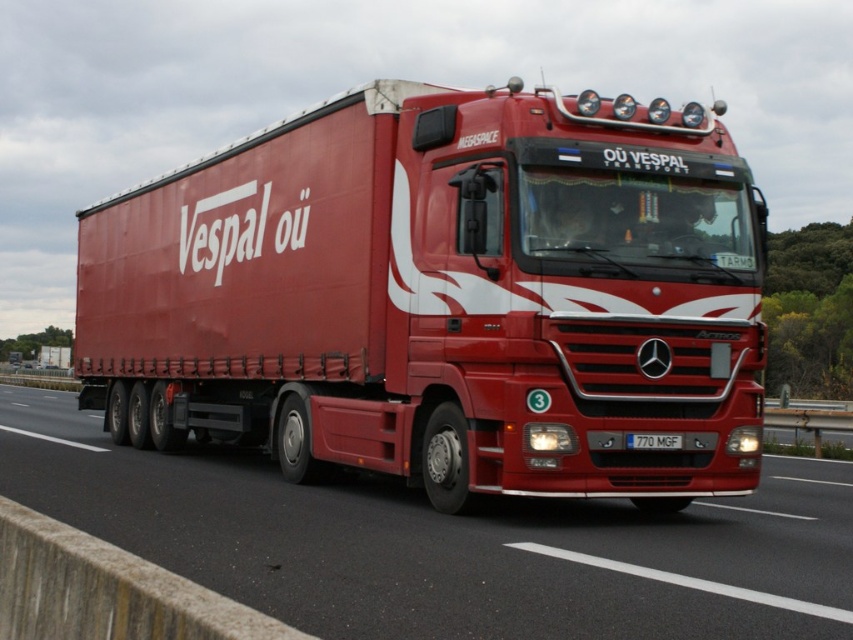
Between matte red trailer truck at center and glossy asphalt road at center, which one appears on the left side from the viewer's perspective?

matte red trailer truck at center

Is matte red trailer truck at center to the right of glossy asphalt road at center from the viewer's perspective?

Incorrect, matte red trailer truck at center is not on the right side of glossy asphalt road at center.

Locate an element on the screen. This screenshot has width=853, height=640. matte red trailer truck at center is located at coordinates (444, 296).

Looking at this image, which of these two, glossy asphalt road at center or white plastic license plate at center, stands shorter?

white plastic license plate at center

Is glossy asphalt road at center bigger than white plastic license plate at center?

Yes.

What are the coordinates of `glossy asphalt road at center` in the screenshot? It's located at coord(445,544).

I want to click on matte red trailer truck at center, so click(444, 296).

Describe the element at coordinates (444, 296) in the screenshot. I see `matte red trailer truck at center` at that location.

Is point (386, 328) positioned after point (641, 433)?

Yes, point (386, 328) is farther from viewer.

This screenshot has width=853, height=640. Identify the location of matte red trailer truck at center. (444, 296).